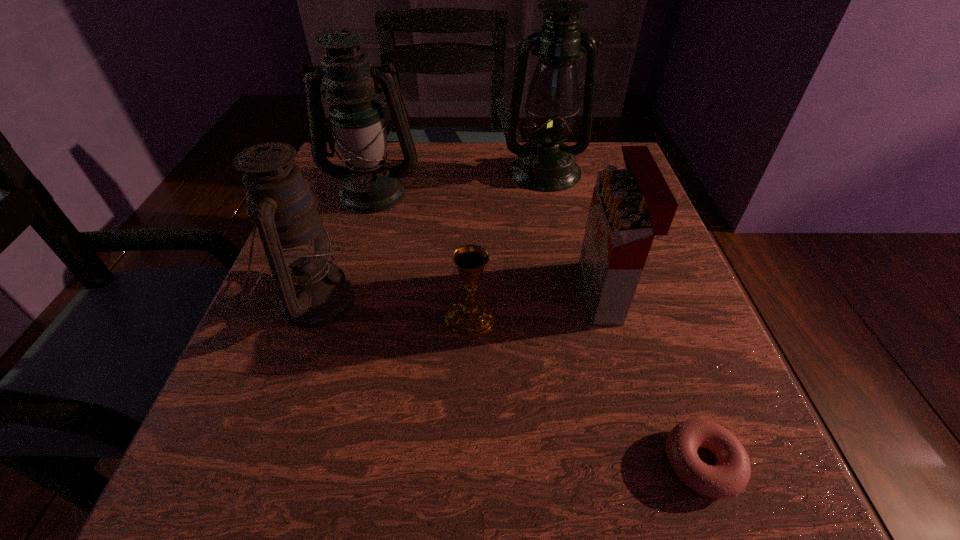
Identify the location of empty space that is in between the rightmost oil lamp and the fourth object from right to left. (508, 244).

This screenshot has height=540, width=960. In order to click on empty space between the cigarette case and the doughnut in this screenshot , I will do `click(653, 377)`.

You are a GUI agent. You are given a task and a screenshot of the screen. Output one action in this format:
    pyautogui.click(x=<x>, y=<y>)
    Task: Click on the object that is the second closest to the third shortest object
    
    Given the screenshot: What is the action you would take?
    pyautogui.click(x=729, y=477)

I want to click on the fifth closest object to the third object from left to right, so click(545, 164).

Identify the location of oil lamp that is the closest to the fifth tallest object. (314, 292).

This screenshot has width=960, height=540. I want to click on the closest oil lamp to the cigarette case, so click(545, 164).

You are a GUI agent. You are given a task and a screenshot of the screen. Output one action in this format:
    pyautogui.click(x=<x>, y=<y>)
    Task: Click on the blank space that satisfies the following two spatial constraints: 1. on the back side of the nearest oil lamp; 2. on the right side of the rightmost oil lamp
    
    Given the screenshot: What is the action you would take?
    pyautogui.click(x=360, y=171)

What are the coordinates of `vacant space that satisfies the following two spatial constraints: 1. on the front side of the doughnut; 2. on the right side of the fourth shortest object` in the screenshot? It's located at (256, 463).